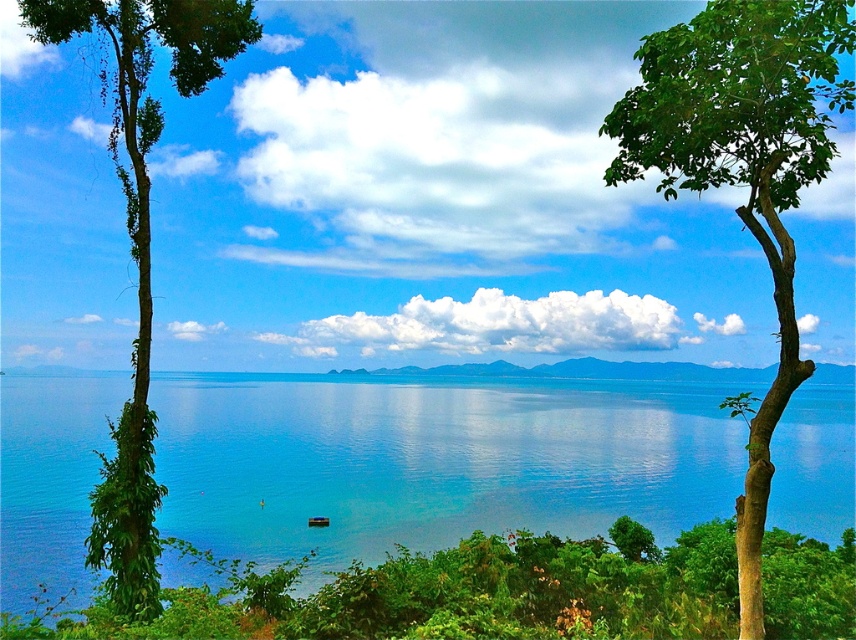
Is transparent blue water at center shorter than green leafy tree at left?

Yes, transparent blue water at center is shorter than green leafy tree at left.

Does transparent blue water at center appear under green leafy tree at left?

Yes, transparent blue water at center is below green leafy tree at left.

Find the location of `transparent blue water at center`. transparent blue water at center is located at coordinates click(432, 460).

Can you confirm if green leafy tree at right is bigger than green leafy tree at left?

Yes.

Can you confirm if green leafy tree at right is positioned to the left of green leafy tree at left?

In fact, green leafy tree at right is to the right of green leafy tree at left.

Is point (794, 147) more distant than point (137, 116)?

No, it is not.

Where is `green leafy tree at right`? green leafy tree at right is located at coordinates (742, 170).

Which is below, transparent blue water at center or green leafy tree at right?

transparent blue water at center is lower down.

Does point (607, 468) come in front of point (782, 4)?

No, (607, 468) is further to viewer.

Does point (629, 509) lie in front of point (664, 113)?

No, (629, 509) is behind (664, 113).

You are a GUI agent. You are given a task and a screenshot of the screen. Output one action in this format:
    pyautogui.click(x=<x>, y=<y>)
    Task: Click on the transparent blue water at center
    
    Given the screenshot: What is the action you would take?
    pyautogui.click(x=432, y=460)